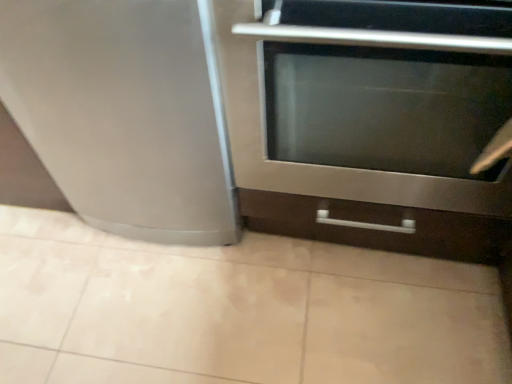
Question: From a real-world perspective, relative to beige ceramic tile at lower center, is stainless steel oven at center vertically above or below?

Choices:
 (A) above
 (B) below

Answer: (A)

Question: Does point (347, 200) appear closer or farther from the camera than point (393, 258)?

Choices:
 (A) farther
 (B) closer

Answer: (B)

Question: Which object is positioned closest to the stainless steel oven at center?

Choices:
 (A) satin silver refrigerator at left
 (B) beige ceramic tile at lower center

Answer: (A)

Question: Considering the real-world distances, which object is closest to the stainless steel oven at center?

Choices:
 (A) beige ceramic tile at lower center
 (B) satin silver refrigerator at left

Answer: (B)